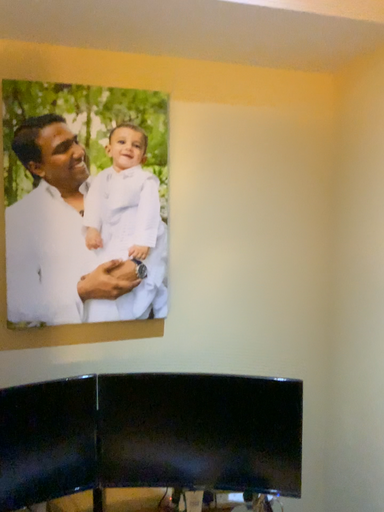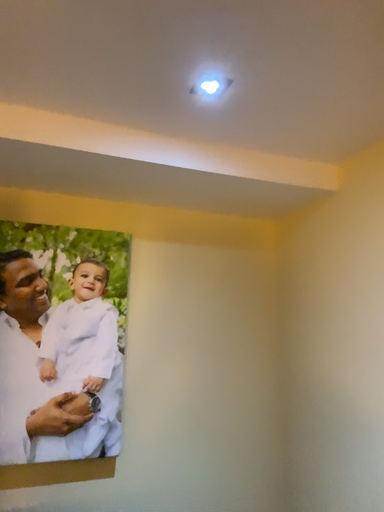
Question: Which way did the camera rotate in the video?

Choices:
 (A) rotated downward
 (B) rotated upward

Answer: (B)